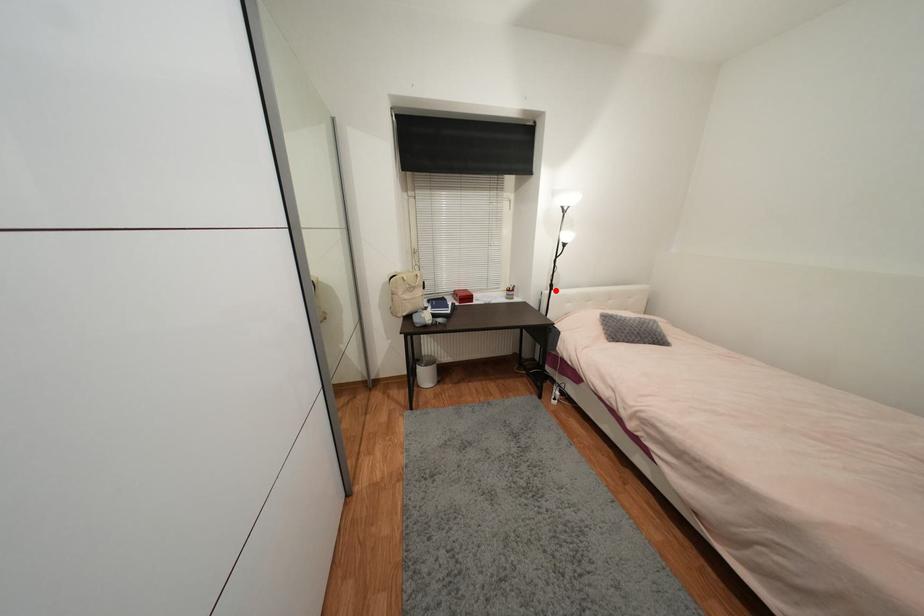
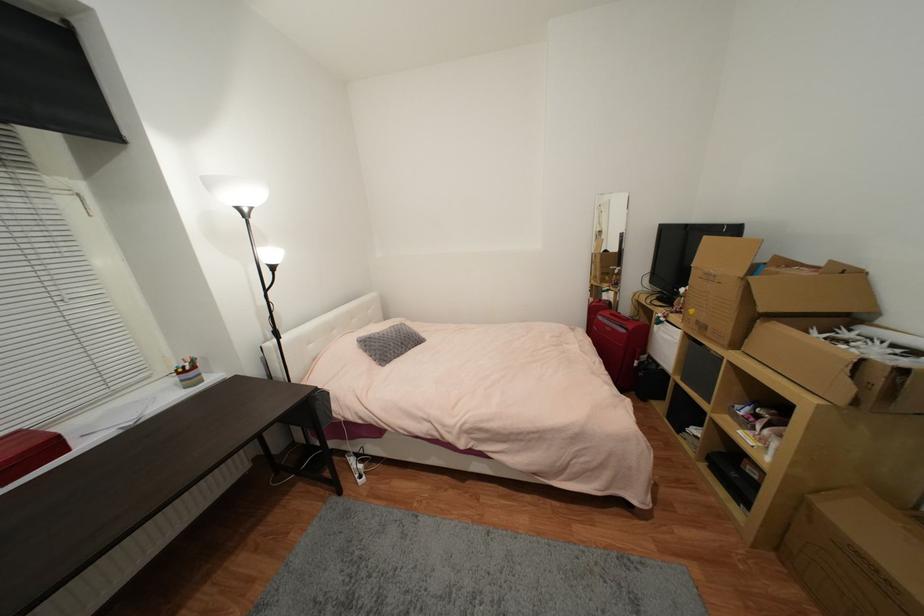
The point at the highlighted location is marked in the first image. Where is the corresponding point in the second image?

(283, 339)